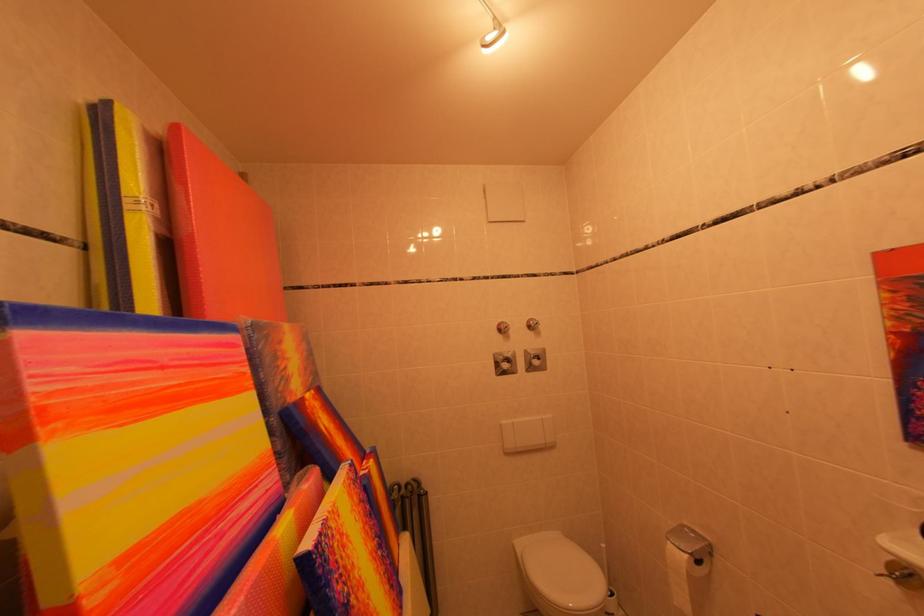
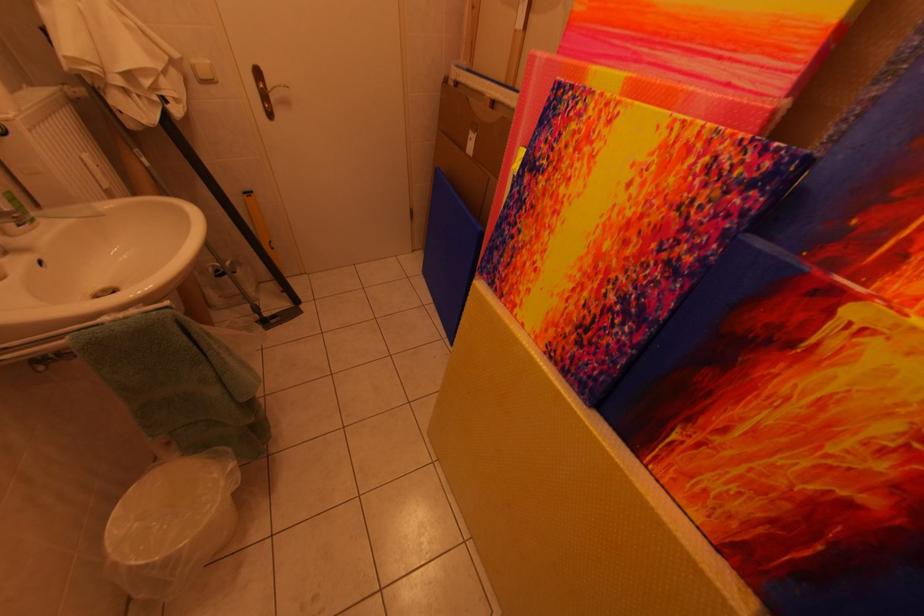
In the second image, find the point that corresponds to (x=359, y=582) in the first image.

(565, 180)